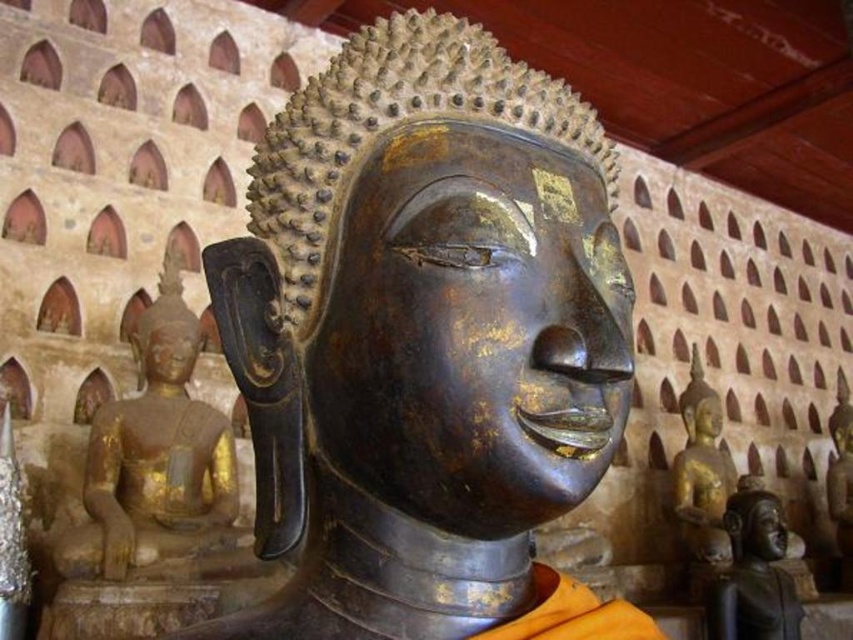
Does gold polished statue at center appear on the right side of gold/gilded statue at center?

Yes, gold polished statue at center is to the right of gold/gilded statue at center.

Describe the element at coordinates (840, 426) in the screenshot. I see `gold polished statue at center` at that location.

Is point (828, 420) in front of point (701, 378)?

No, it is behind (701, 378).

Where is `gold polished statue at center`? Image resolution: width=853 pixels, height=640 pixels. gold polished statue at center is located at coordinates (840, 426).

Between gold leaf statue at center and gold/gilded statue at center, which one has more height?

gold leaf statue at center is taller.

Is point (177, 499) in front of point (693, 374)?

Yes.

Which is behind, point (134, 490) or point (708, 396)?

The point (708, 396) is behind.

Locate an element on the screen. Image resolution: width=853 pixels, height=640 pixels. gold leaf statue at center is located at coordinates (155, 456).

Is gold leaf statue at center bigger than bronze statue at lower right?

Correct, gold leaf statue at center is larger in size than bronze statue at lower right.

Does point (175, 307) lie behind point (779, 600)?

No.

The image size is (853, 640). I want to click on gold leaf statue at center, so pyautogui.click(x=155, y=456).